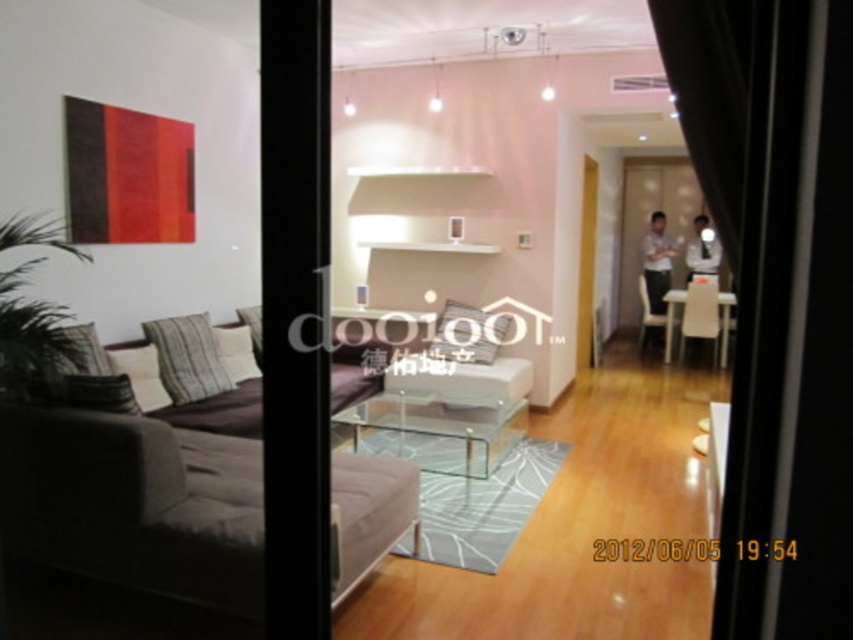
You are standing in the doorway of the living space and notice two points marked in the room. The first point is at coordinate point (3,413) and the second is at point (445,426). Which point is closer to your current position?

Point (3,413) is in front of point (445,426), so it is closer to your current position in the doorway.

You are standing in the doorway of the living space and want to let more natural light into the room. Which object should you adjust or move to achieve this, the black fabric curtain at right or the transparent glass door at center?

The transparent glass door at center allows natural light to enter, so adjusting or opening it further would let more light in. The black fabric curtain at right is below the door and may block some light if closed, so opening the transparent glass door at center would be more effective.